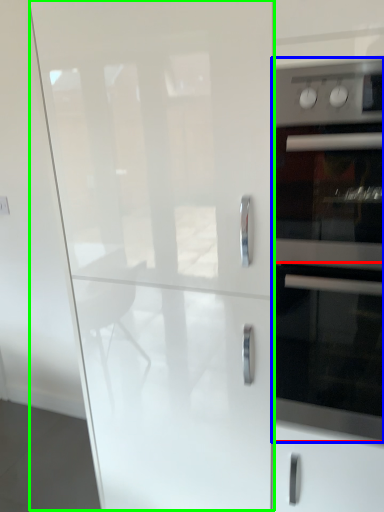
Question: Based on their relative distances, which object is farther from oven (highlighted by a red box)? Choose from home appliance (highlighted by a blue box) and glass door (highlighted by a green box).

Choices:
 (A) home appliance
 (B) glass door

Answer: (B)